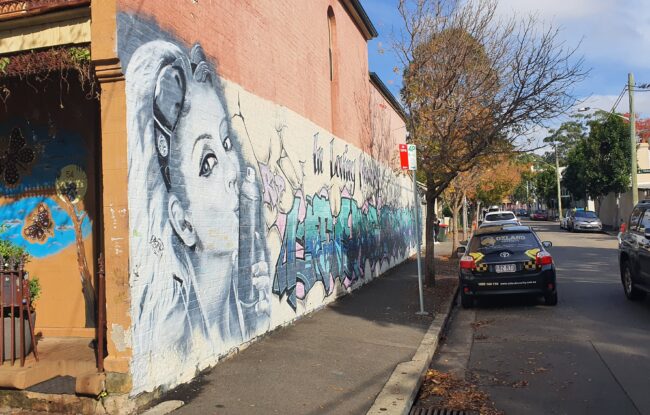
You are a GUI agent. You are given a task and a screenshot of the screen. Output one action in this format:
    pyautogui.click(x=<x>, y=<y>)
    Task: Click on the eyes of the painting
    This screenshot has width=650, height=415.
    Given the screenshot: What is the action you would take?
    pyautogui.click(x=209, y=170), pyautogui.click(x=226, y=146)